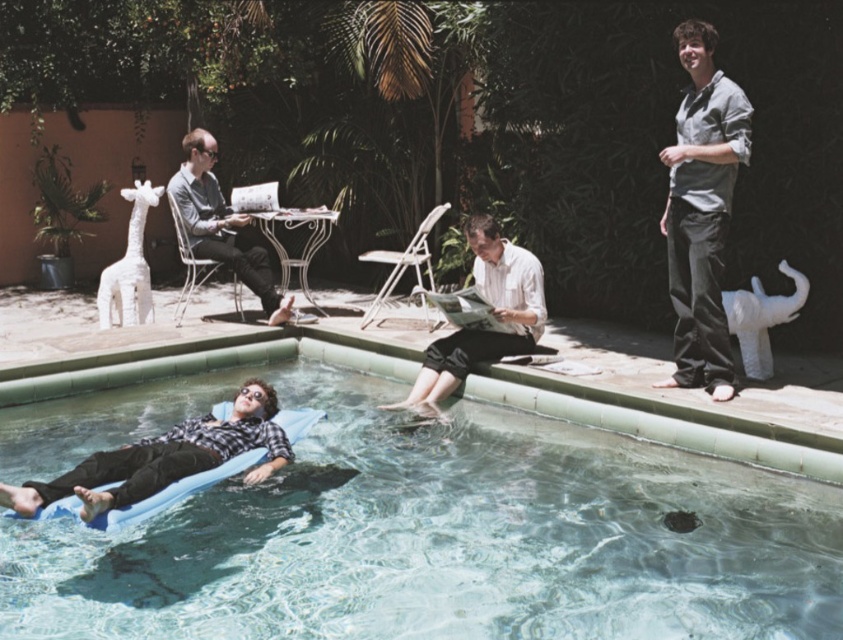
Question: Is clear blue water at lower center below white paper at center?

Choices:
 (A) no
 (B) yes

Answer: (B)

Question: Which object is the closest to the light gray fabric chair at left?

Choices:
 (A) clear blue water at lower center
 (B) gray cotton shirt at upper right

Answer: (A)

Question: Which object is farther from the camera taking this photo?

Choices:
 (A) blue foam mattress at lower left
 (B) light gray fabric chair at left
 (C) white paper at center
 (D) gray cotton shirt at upper right

Answer: (B)

Question: Is clear blue water at lower center further to the viewer compared to gray cotton shirt at upper right?

Choices:
 (A) yes
 (B) no

Answer: (B)

Question: Which point is farther from the camera taking this photo?

Choices:
 (A) (39, 497)
 (B) (218, 252)
 (C) (508, 349)
 (D) (804, 496)

Answer: (B)

Question: Is gray cotton shirt at upper right below light gray fabric chair at left?

Choices:
 (A) no
 (B) yes

Answer: (B)